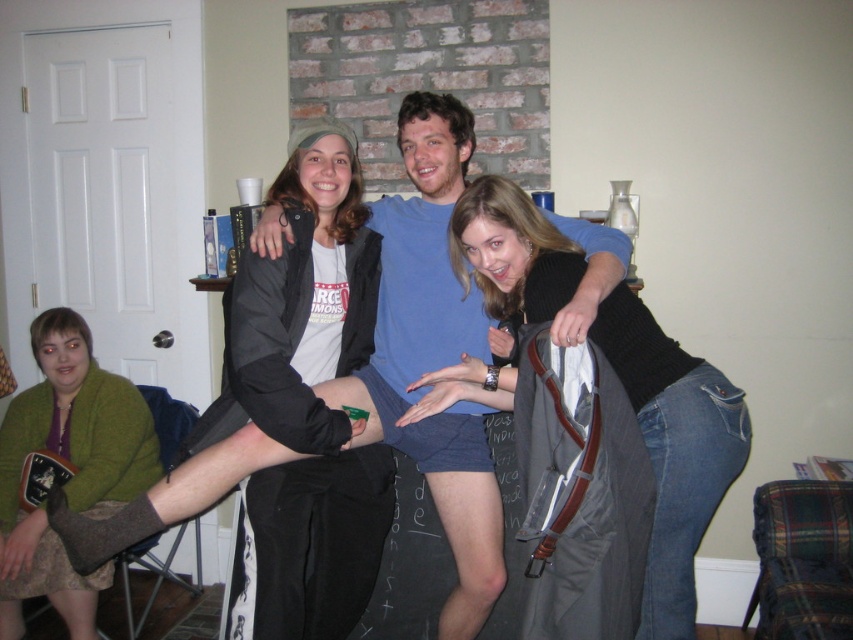
Which is below, blue cotton shirt at center or jeans at center?

jeans at center is lower down.

Measure the distance between point (479, 444) and camera.

Point (479, 444) is 7.02 feet from camera.

The image size is (853, 640). In order to click on blue cotton shirt at center in this screenshot , I will do `click(436, 353)`.

Does blue cotton shirt at center appear under green fuzzy sweater at lower left?

No, blue cotton shirt at center is not below green fuzzy sweater at lower left.

Which is behind, point (387, 376) or point (38, 525)?

Point (38, 525)

Who is more forward, (460, 476) or (151, 483)?

Positioned in front is point (460, 476).

The image size is (853, 640). I want to click on blue cotton shirt at center, so click(x=436, y=353).

Does point (656, 620) come in front of point (103, 429)?

That is True.

Describe the element at coordinates (672, 451) in the screenshot. Image resolution: width=853 pixels, height=640 pixels. I see `jeans at center` at that location.

The image size is (853, 640). Find the location of `jeans at center`. jeans at center is located at coordinates (672, 451).